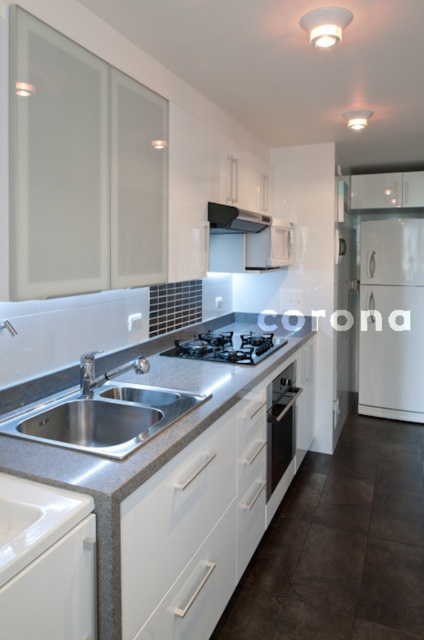
You are standing in the kitchen and need to place a new appliance. The white matte refrigerator at right is currently at coordinates point 0.498, 0.925. If you want to place a new appliance 0.1 meters to the left of it, where would you position the new appliance?

The new appliance should be placed 0.1 meters to the left of the white matte refrigerator at right, which is currently located at point (392,317).

You are planning to install a new appliance in your kitchen. You have a white matte refrigerator at right and a black glass stove at center. Which appliance would require a taller space in the kitchen?

The white matte refrigerator at right is taller than the black glass stove at center, so it would require a taller space in the kitchen.